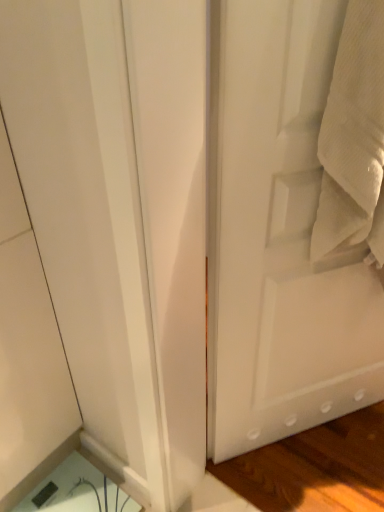
Question: From a real-world perspective, is white matte door at right located higher than white textured towel at right?

Choices:
 (A) no
 (B) yes

Answer: (A)

Question: Is white matte door at right positioned beyond the bounds of white textured towel at right?

Choices:
 (A) yes
 (B) no

Answer: (A)

Question: Does white matte door at right have a greater height compared to white textured towel at right?

Choices:
 (A) no
 (B) yes

Answer: (B)

Question: Is white matte door at right facing away from white textured towel at right?

Choices:
 (A) no
 (B) yes

Answer: (B)

Question: From the image's perspective, is white matte door at right above white textured towel at right?

Choices:
 (A) yes
 (B) no

Answer: (B)

Question: Is white matte door at right facing towards white textured towel at right?

Choices:
 (A) yes
 (B) no

Answer: (A)

Question: Is white textured towel at right smaller than white matte door at right?

Choices:
 (A) no
 (B) yes

Answer: (B)

Question: From the image's perspective, is white textured towel at right over white matte door at right?

Choices:
 (A) yes
 (B) no

Answer: (A)

Question: Is white textured towel at right next to white matte door at right and touching it?

Choices:
 (A) no
 (B) yes

Answer: (A)

Question: Is white textured towel at right looking in the opposite direction of white matte door at right?

Choices:
 (A) yes
 (B) no

Answer: (A)

Question: Is white textured towel at right closer to camera compared to white matte door at right?

Choices:
 (A) yes
 (B) no

Answer: (A)

Question: Is white textured towel at right far from white matte door at right?

Choices:
 (A) no
 (B) yes

Answer: (A)

Question: Is white matte door at right wider or thinner than white textured towel at right?

Choices:
 (A) wide
 (B) thin

Answer: (B)